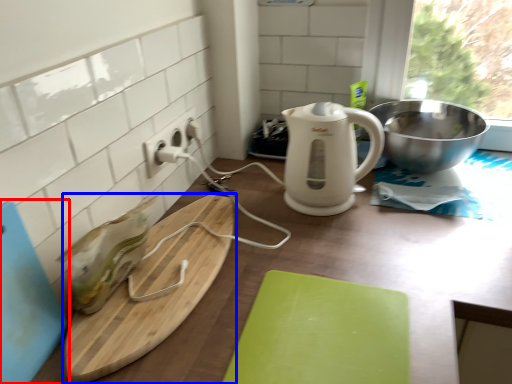
Question: Which point is closer to the camera, cutting board (highlighted by a red box) or cutting board (highlighted by a blue box)?

Choices:
 (A) cutting board
 (B) cutting board

Answer: (A)